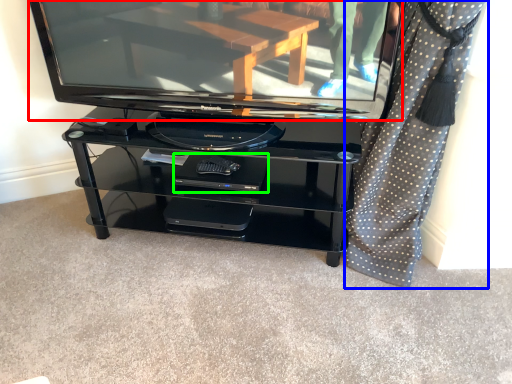
Question: Estimate the real-world distances between objects in this image. Which object is farther from television (highlighted by a red box), curtain (highlighted by a blue box) or footrest (highlighted by a green box)?

Choices:
 (A) curtain
 (B) footrest

Answer: (A)